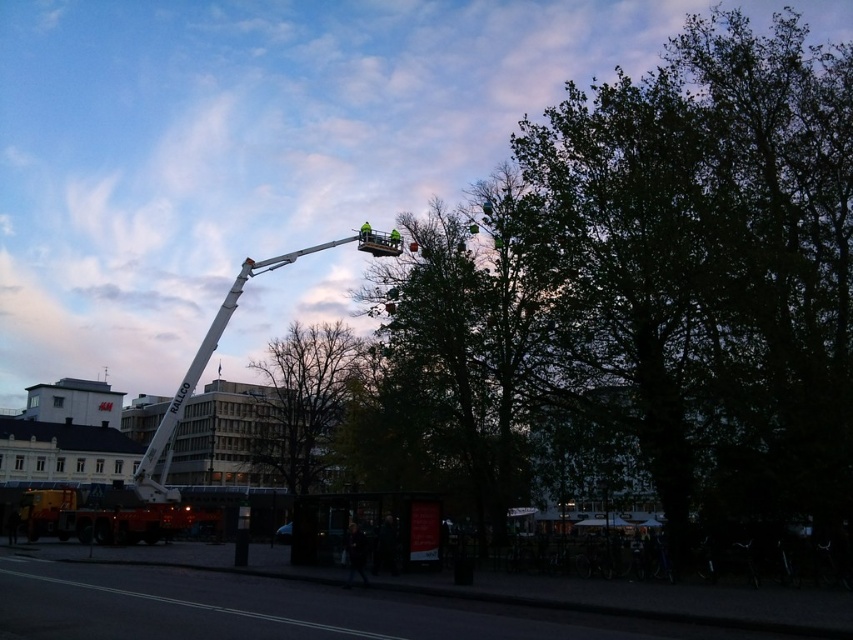
Between point (758, 35) and point (165, 467), which one is positioned in front?

Positioned in front is point (165, 467).

The width and height of the screenshot is (853, 640). Identify the location of green leafy tree at upper center. (656, 296).

Who is more distant from viewer, (424,440) or (312,250)?

Positioned behind is point (312,250).

What are the coordinates of `green leafy tree at upper center` in the screenshot? It's located at (656, 296).

This screenshot has height=640, width=853. Describe the element at coordinates (305, 401) in the screenshot. I see `bare branches at center` at that location.

Who is more forward, (296, 337) or (242, 285)?

Positioned in front is point (242, 285).

Locate an element on the screen. The image size is (853, 640). bare branches at center is located at coordinates (305, 401).

Can you confirm if green leafy tree at upper center is bigger than bare branches at center?

Yes.

You are a GUI agent. You are given a task and a screenshot of the screen. Output one action in this format:
    pyautogui.click(x=<x>, y=<y>)
    Task: Click on the green leafy tree at upper center
    This screenshot has width=853, height=640.
    Given the screenshot: What is the action you would take?
    pyautogui.click(x=656, y=296)

Locate an element on the screen. The image size is (853, 640). green leafy tree at upper center is located at coordinates (656, 296).